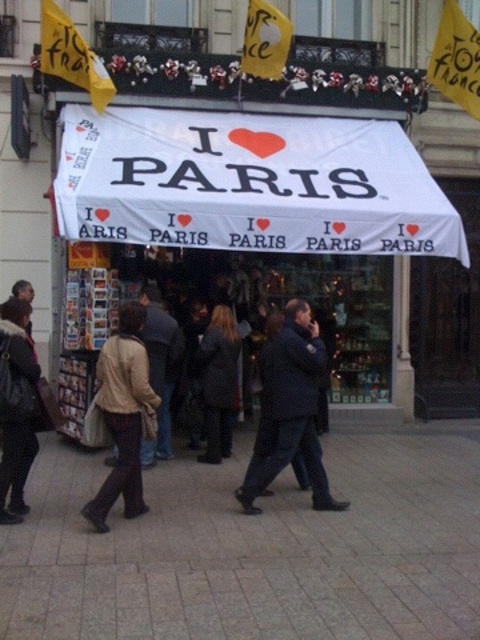
You are a street performer planning to set up a small stage in the middle of the pavement. You have a stage that is the same width as the dark blue jacket at center. Will the stage fit under the white fabric canopy at center?

The white fabric canopy at center has a width larger than the dark blue jacket at center, so the stage with the same width as the dark blue jacket at center will fit under the white fabric canopy at center.

You are a tourist standing on the sidewalk in front of the shop. You notice the white fabric canopy at center and the dark blue jacket at center. Which object is higher from the ground?

The white fabric canopy at center is above the dark blue jacket at center, so the white fabric canopy at center is higher from the ground.